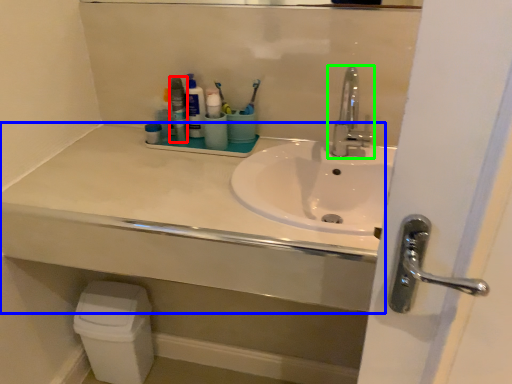
Question: Based on their relative distances, which object is farther from mouthwash (highlighted by a red box)? Choose from counter top (highlighted by a blue box) and tap (highlighted by a green box).

Choices:
 (A) counter top
 (B) tap

Answer: (B)